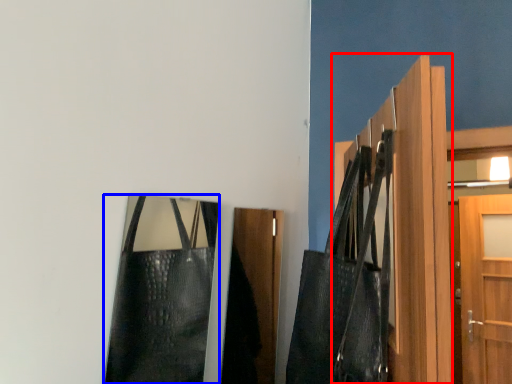
Question: Which object is closer to the camera taking this photo, door (highlighted by a red box) or bag (highlighted by a blue box)?

Choices:
 (A) door
 (B) bag

Answer: (A)